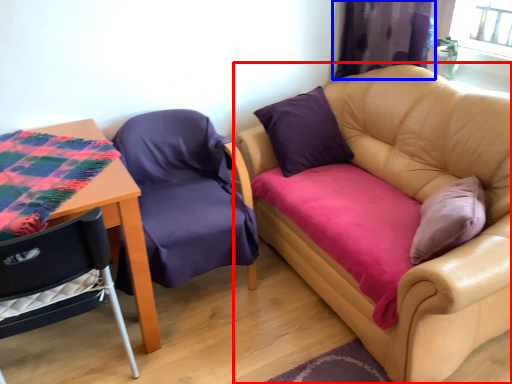
Question: Among these objects, which one is nearest to the camera, studio couch (highlighted by a red box) or curtain (highlighted by a blue box)?

Choices:
 (A) studio couch
 (B) curtain

Answer: (A)